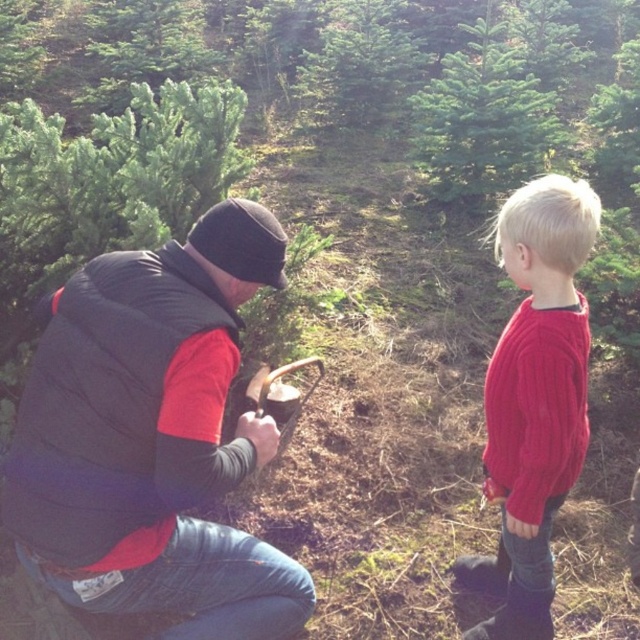
Question: Which point is closer to the camera taking this photo?

Choices:
 (A) (204, 276)
 (B) (452, 173)
 (C) (596, 224)

Answer: (A)

Question: Is the position of matte black vest at left more distant than that of cable-knit sweater at right?

Choices:
 (A) yes
 (B) no

Answer: (B)

Question: Which object appears farthest from the camera in this image?

Choices:
 (A) matte black vest at left
 (B) cable-knit sweater at right

Answer: (B)

Question: Estimate the real-world distances between objects in this image. Which object is farther from the matte black vest at left?

Choices:
 (A) green matte tree at upper center
 (B) cable-knit sweater at right

Answer: (A)

Question: Is matte black vest at left above green matte tree at upper center?

Choices:
 (A) no
 (B) yes

Answer: (A)

Question: Observing the image, what is the correct spatial positioning of matte black vest at left in reference to cable-knit sweater at right?

Choices:
 (A) below
 (B) above

Answer: (B)